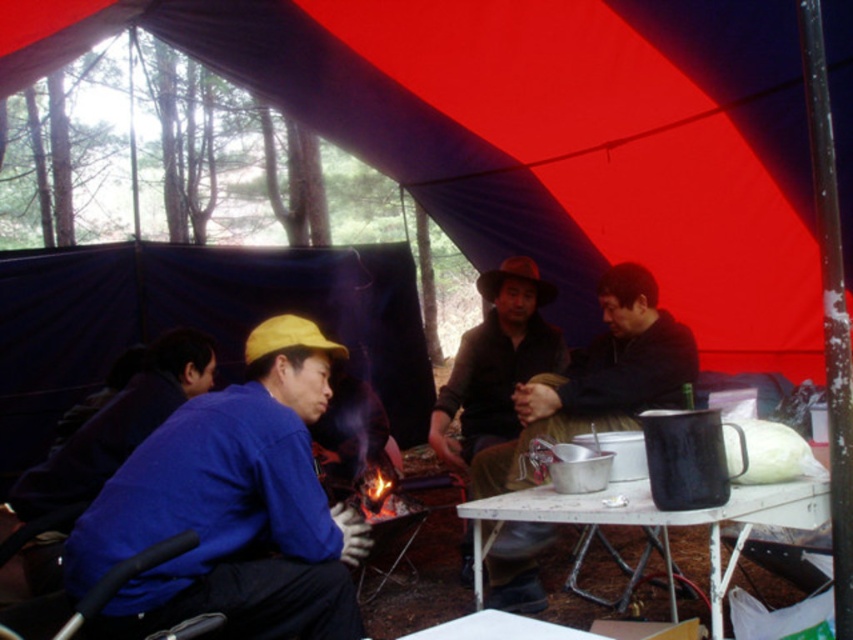
Question: From the image, what is the correct spatial relationship of matte black jacket at center in relation to brown leather hat at center?

Choices:
 (A) below
 (B) above

Answer: (A)

Question: Among these objects, which one is nearest to the camera?

Choices:
 (A) matte black jacket at center
 (B) brown leather hat at center
 (C) blue fabric shirt at center
 (D) white plastic table at center

Answer: (D)

Question: Is matte black jacket at center wider than brown leather hat at center?

Choices:
 (A) yes
 (B) no

Answer: (A)

Question: Among these points, which one is nearest to the camera?

Choices:
 (A) (509, 529)
 (B) (541, 337)
 (C) (827, 516)
 (D) (114, 634)

Answer: (C)

Question: Among these objects, which one is farthest from the camera?

Choices:
 (A) blue fabric shirt at center
 (B) white plastic table at center
 (C) brown leather hat at center
 (D) matte black jacket at center

Answer: (C)

Question: Does blue fabric shirt at center have a lesser width compared to white plastic table at center?

Choices:
 (A) yes
 (B) no

Answer: (A)